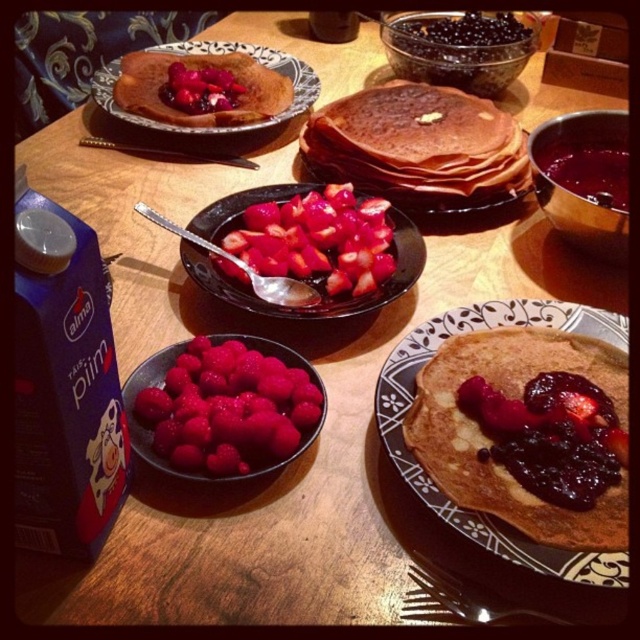
You are arranging a fruit platter and need to place the bright red berries at center and the sliced red strawberries at center on the table. According to the image, which fruit should be placed to the left of the other?

Answer: The bright red berries at center should be placed to the left of the sliced red strawberries at center because the bright red berries at center are located to the left of sliced red strawberries at center in the image.

You are a diner looking at the breakfast table. You want to grab the bright red berries at center but are worried they might be hidden by something. Is the brown matte pancake at center blocking your access to them?

The bright red berries at center is positioned under brown matte pancake at center, so the brown matte pancake at center is blocking access to the bright red berries at center.

You are arranging a picnic basket and need to know the position of the bright red berries at center relative to the other items on the table. Based on the coordinates provided, can you determine if they are closer to the edge of the table or near the center?

The bright red berries at center are located at coordinates point (225, 404), which places them near the center of the table rather than the edge.